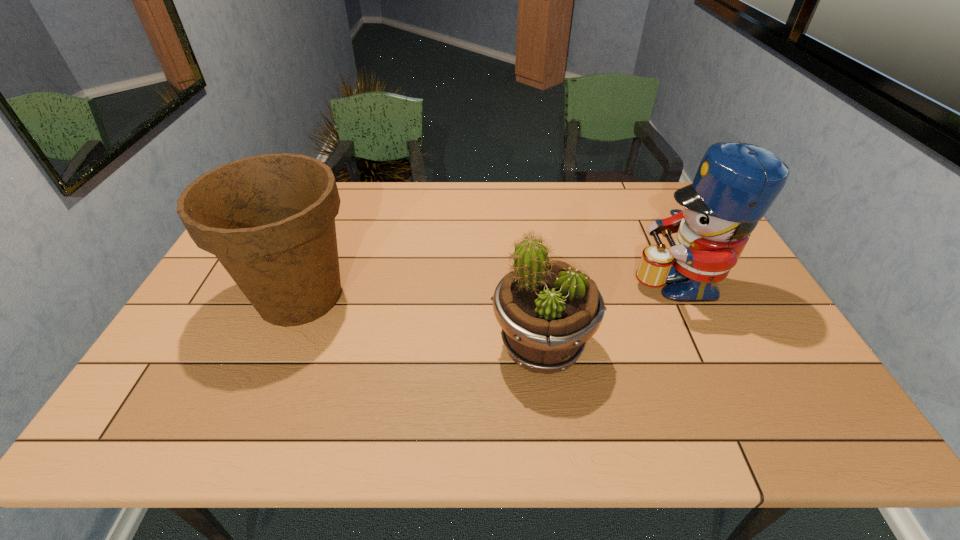
At what (x,y) coordinates should I click in order to perform the action: click on the tallest object. Please return your answer as a coordinate pair (x, y). The height and width of the screenshot is (540, 960). Looking at the image, I should click on (736, 183).

Locate an element on the screen. nutcracker is located at coordinates (736, 183).

Where is `the leftmost object`? The image size is (960, 540). the leftmost object is located at coordinates (269, 219).

Locate an element on the screen. This screenshot has width=960, height=540. the second object from left to right is located at coordinates [x=547, y=310].

Where is `vacant space located 0.270m on the front-facing side of the rightmost object`? vacant space located 0.270m on the front-facing side of the rightmost object is located at coordinates (538, 280).

Find the location of a particular element. The height and width of the screenshot is (540, 960). free space located 0.290m on the front-facing side of the rightmost object is located at coordinates (531, 280).

At what (x,y) coordinates should I click in order to perform the action: click on free location located 0.050m on the front-facing side of the rightmost object. Please return your answer as a coordinate pair (x, y). The width and height of the screenshot is (960, 540). Looking at the image, I should click on (613, 280).

At what (x,y) coordinates should I click in order to perform the action: click on vacant area situated on the back of the left flowerpot. Please return your answer as a coordinate pair (x, y). The width and height of the screenshot is (960, 540). Looking at the image, I should click on (343, 193).

Image resolution: width=960 pixels, height=540 pixels. Identify the location of free location located 0.190m on the left of the right flowerpot. (414, 347).

This screenshot has width=960, height=540. Identify the location of object present at the left edge. (269, 219).